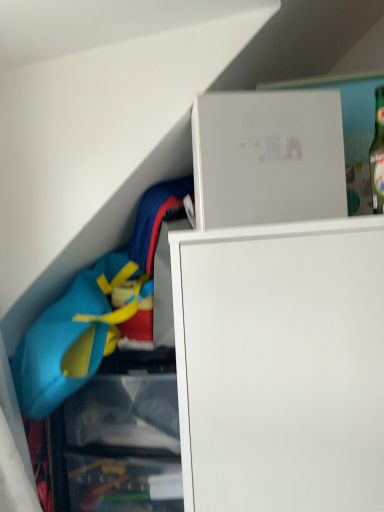
What do you see at coordinates (73, 336) in the screenshot?
I see `matte blue life vest at left` at bounding box center [73, 336].

You are a GUI agent. You are given a task and a screenshot of the screen. Output one action in this format:
    pyautogui.click(x=<x>, y=<y>)
    Task: Click on the matte blue life vest at left
    The width and height of the screenshot is (384, 512).
    Given the screenshot: What is the action you would take?
    pyautogui.click(x=73, y=336)

The image size is (384, 512). Describe the element at coordinates (268, 158) in the screenshot. I see `white matte box at upper center` at that location.

Locate an element on the screen. The height and width of the screenshot is (512, 384). white matte box at upper center is located at coordinates (268, 158).

Where is `matte blue life vest at left`? matte blue life vest at left is located at coordinates (73, 336).

Which is more to the right, matte blue life vest at left or white matte box at upper center?

white matte box at upper center.

Is matte blue life vest at left positioned in front of white matte box at upper center?

That is False.

Is point (32, 411) farther from viewer compared to point (208, 204)?

Yes.

From the image's perspective, between matte blue life vest at left and white matte box at upper center, who is located below?

matte blue life vest at left is shown below in the image.

From a real-world perspective, is matte blue life vest at left located beneath white matte box at upper center?

Yes, from a real-world perspective, matte blue life vest at left is below white matte box at upper center.

Which of these two, matte blue life vest at left or white matte box at upper center, is thinner?

With smaller width is white matte box at upper center.

Is matte blue life vest at left shorter than white matte box at upper center?

No, matte blue life vest at left is not shorter than white matte box at upper center.

Considering the sizes of objects matte blue life vest at left and white matte box at upper center in the image provided, who is smaller, matte blue life vest at left or white matte box at upper center?

white matte box at upper center is smaller.

From the picture: Is matte blue life vest at left outside of white matte box at upper center?

That's correct, matte blue life vest at left is outside of white matte box at upper center.

Is matte blue life vest at left not close to white matte box at upper center?

No, matte blue life vest at left is in close proximity to white matte box at upper center.

Is matte blue life vest at left positioned with its back to white matte box at upper center?

No, matte blue life vest at left is not facing the opposite direction of white matte box at upper center.

From the picture: What's the angular difference between matte blue life vest at left and white matte box at upper center's facing directions?

The angular difference between matte blue life vest at left and white matte box at upper center is 22.5 degrees.

Identify the location of cabinet above the matte blue life vest at left (from the image's perspective). The image size is (384, 512). (268, 158).

Considering the relative positions of white matte box at upper center and matte blue life vest at left in the image provided, is white matte box at upper center to the left of matte blue life vest at left from the viewer's perspective?

Incorrect, white matte box at upper center is not on the left side of matte blue life vest at left.

Does white matte box at upper center come behind matte blue life vest at left?

No.

Does point (339, 99) appear closer or farther from the camera than point (106, 332)?

Point (339, 99).

From the image's perspective, which one is positioned lower, white matte box at upper center or matte blue life vest at left?

matte blue life vest at left is shown below in the image.

From a real-world perspective, which object rests below the other?

matte blue life vest at left is physically lower.

Which of these two, white matte box at upper center or matte blue life vest at left, is thinner?

With smaller width is white matte box at upper center.

Consider the image. Is white matte box at upper center taller or shorter than matte blue life vest at left?

Considering their sizes, white matte box at upper center has less height than matte blue life vest at left.

Considering the relative sizes of white matte box at upper center and matte blue life vest at left in the image provided, is white matte box at upper center smaller than matte blue life vest at left?

Correct, white matte box at upper center occupies less space than matte blue life vest at left.

Is white matte box at upper center surrounding matte blue life vest at left?

No.

Would you say white matte box at upper center is a long distance from matte blue life vest at left?

No.

Is white matte box at upper center facing away from matte blue life vest at left?

No, matte blue life vest at left is not at the back of white matte box at upper center.

Locate an element on the screen. The image size is (384, 512). cabinet lying on the right of matte blue life vest at left is located at coordinates (268, 158).

Find the location of a particular element. cabinet that is on the right side of matte blue life vest at left is located at coordinates (268, 158).

What are the coordinates of `clothing directly beneath the white matte box at upper center (from a real-world perspective)` in the screenshot? It's located at (73, 336).